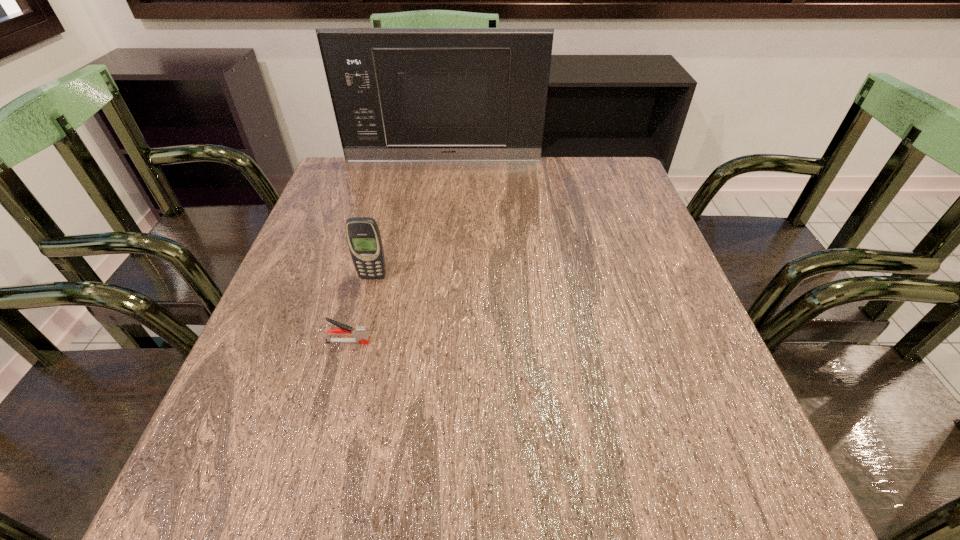
Where is `microwave oven located at the left edge`? The width and height of the screenshot is (960, 540). microwave oven located at the left edge is located at coordinates (399, 94).

The image size is (960, 540). In order to click on cellular telephone that is at the left edge in this screenshot , I will do [363, 236].

The height and width of the screenshot is (540, 960). Find the location of `stapler at the left edge`. stapler at the left edge is located at coordinates (360, 333).

Locate an element on the screen. This screenshot has width=960, height=540. object positioned at the far left corner is located at coordinates (399, 94).

You are a GUI agent. You are given a task and a screenshot of the screen. Output one action in this format:
    pyautogui.click(x=<x>, y=<y>)
    Task: Click on the vacant area at the far edge
    The height and width of the screenshot is (540, 960).
    Given the screenshot: What is the action you would take?
    pyautogui.click(x=548, y=188)

In the image, there is a desktop. Where is `free space at the left edge`? The image size is (960, 540). free space at the left edge is located at coordinates coord(326,302).

In the image, there is a desktop. What are the coordinates of `free region at the right edge` in the screenshot? It's located at click(676, 449).

Find the location of a particular element. The width and height of the screenshot is (960, 540). free space at the far left corner of the desktop is located at coordinates (375, 178).

In the image, there is a desktop. Where is `free space at the near left corner`? free space at the near left corner is located at coordinates (224, 465).

This screenshot has height=540, width=960. Identify the location of free space at the far right corner. (616, 173).